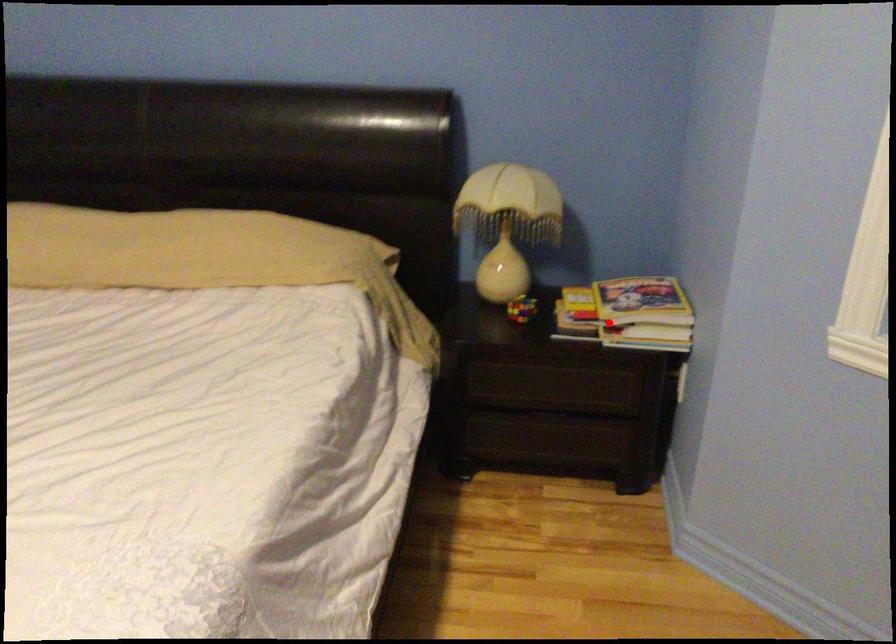
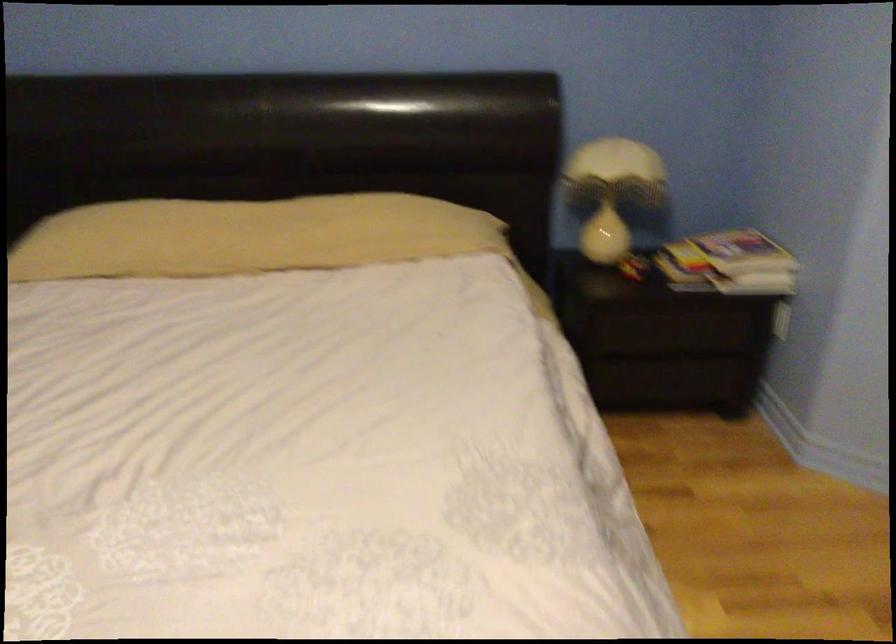
Locate, in the second image, the point that corresponds to the highlighted location in the first image.

(728, 263)